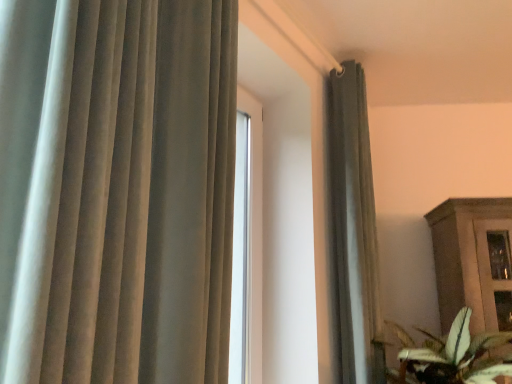
Find the location of `satin gray curtain at upper right`. satin gray curtain at upper right is located at coordinates pyautogui.click(x=353, y=228).

The height and width of the screenshot is (384, 512). What do you see at coordinates (353, 228) in the screenshot?
I see `satin gray curtain at upper right` at bounding box center [353, 228].

Describe the element at coordinates (451, 356) in the screenshot. I see `green leafy plant at lower right` at that location.

The height and width of the screenshot is (384, 512). I want to click on green leafy plant at lower right, so click(x=451, y=356).

Identify the location of satin gray curtain at upper right. (353, 228).

Considering the relative positions of green leafy plant at lower right and satin gray curtain at upper right in the image provided, is green leafy plant at lower right to the left or to the right of satin gray curtain at upper right?

Based on their positions, green leafy plant at lower right is located to the right of satin gray curtain at upper right.

Considering their positions, is green leafy plant at lower right located in front of or behind satin gray curtain at upper right?

Visually, green leafy plant at lower right is located in front of satin gray curtain at upper right.

Does point (458, 376) appear closer or farther from the camera than point (367, 349)?

Point (458, 376).

From the image's perspective, which is above, green leafy plant at lower right or satin gray curtain at upper right?

satin gray curtain at upper right.

From a real-world perspective, who is located lower, green leafy plant at lower right or satin gray curtain at upper right?

In real-world perspective, green leafy plant at lower right is lower.

Considering the sizes of objects green leafy plant at lower right and satin gray curtain at upper right in the image provided, who is thinner, green leafy plant at lower right or satin gray curtain at upper right?

With smaller width is satin gray curtain at upper right.

Considering the relative sizes of green leafy plant at lower right and satin gray curtain at upper right in the image provided, is green leafy plant at lower right taller than satin gray curtain at upper right?

Incorrect, the height of green leafy plant at lower right is not larger of that of satin gray curtain at upper right.

Is green leafy plant at lower right bigger than satin gray curtain at upper right?

Yes, green leafy plant at lower right is bigger than satin gray curtain at upper right.

Is green leafy plant at lower right positioned beyond the bounds of satin gray curtain at upper right?

Yes.

Is green leafy plant at lower right with satin gray curtain at upper right?

No, green leafy plant at lower right is not next to satin gray curtain at upper right.

Could you tell me if green leafy plant at lower right is facing satin gray curtain at upper right?

No, green leafy plant at lower right is not oriented towards satin gray curtain at upper right.

How many degrees apart are the facing directions of green leafy plant at lower right and satin gray curtain at upper right?

The angular difference between green leafy plant at lower right and satin gray curtain at upper right is 30.6 degrees.

Locate an element on the screen. houseplant on the right of satin gray curtain at upper right is located at coordinates (451, 356).

In the image, is satin gray curtain at upper right on the left side or the right side of green leafy plant at lower right?

satin gray curtain at upper right is positioned on green leafy plant at lower right's left side.

Between satin gray curtain at upper right and green leafy plant at lower right, which one is positioned in front?

green leafy plant at lower right is more forward.

Is point (353, 174) more distant than point (470, 339)?

Yes, it is.

From the image's perspective, is satin gray curtain at upper right positioned above or below green leafy plant at lower right?

satin gray curtain at upper right is situated higher than green leafy plant at lower right in the image.

From a real-world perspective, is satin gray curtain at upper right above or below green leafy plant at lower right?

In terms of real-world spatial position, satin gray curtain at upper right is above green leafy plant at lower right.

Considering the sizes of objects satin gray curtain at upper right and green leafy plant at lower right in the image provided, who is thinner, satin gray curtain at upper right or green leafy plant at lower right?

With smaller width is satin gray curtain at upper right.

Considering the sizes of satin gray curtain at upper right and green leafy plant at lower right in the image, is satin gray curtain at upper right taller or shorter than green leafy plant at lower right?

Clearly, satin gray curtain at upper right is taller compared to green leafy plant at lower right.

Is satin gray curtain at upper right bigger than green leafy plant at lower right?

Actually, satin gray curtain at upper right might be smaller than green leafy plant at lower right.

Would you say satin gray curtain at upper right contains green leafy plant at lower right?

No, green leafy plant at lower right is not inside satin gray curtain at upper right.

Is there a large distance between satin gray curtain at upper right and green leafy plant at lower right?

satin gray curtain at upper right is near green leafy plant at lower right, not far away.

Is green leafy plant at lower right at the back of satin gray curtain at upper right?

No, satin gray curtain at upper right is not facing the opposite direction of green leafy plant at lower right.

In the scene shown: What's the angular difference between satin gray curtain at upper right and green leafy plant at lower right's facing directions?

30.6 degrees separate the facing orientations of satin gray curtain at upper right and green leafy plant at lower right.

The height and width of the screenshot is (384, 512). In order to click on houseplant on the right of the satin gray curtain at upper right in this screenshot , I will do `click(451, 356)`.

I want to click on houseplant on the right of satin gray curtain at upper right, so click(451, 356).

Find the location of a particular element. This screenshot has width=512, height=384. houseplant below the satin gray curtain at upper right (from the image's perspective) is located at coordinates (451, 356).